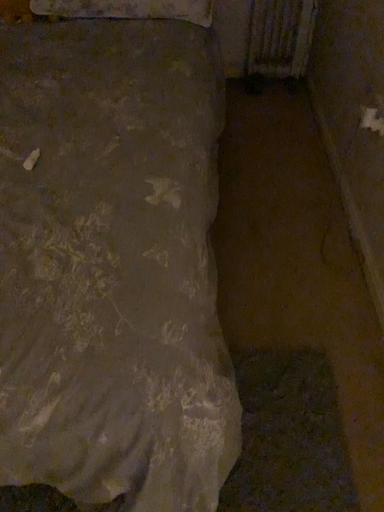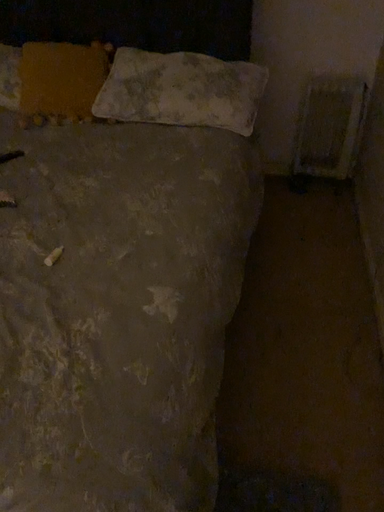
Question: How did the camera likely rotate when shooting the video?

Choices:
 (A) rotated downward
 (B) rotated upward

Answer: (B)